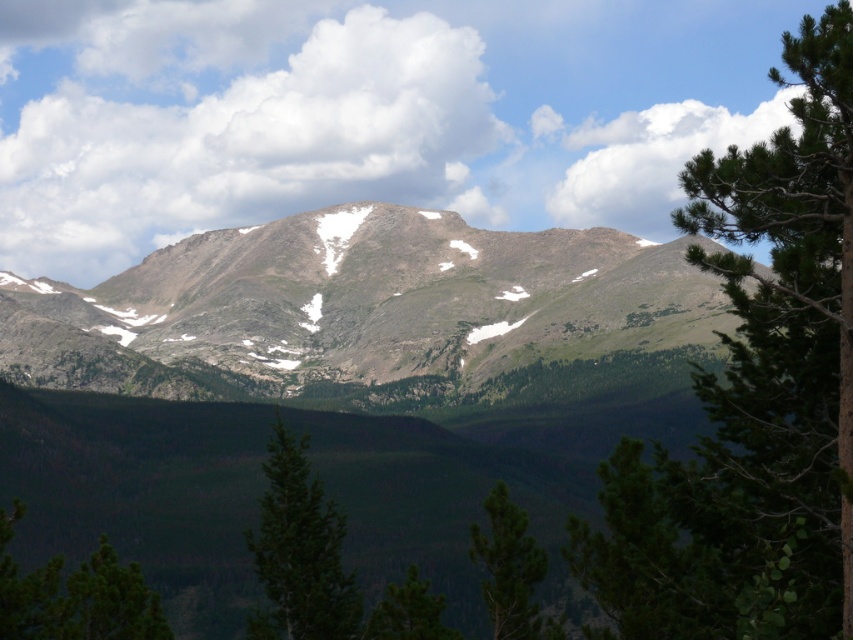
Question: Which point appears farthest from the camera in this image?

Choices:
 (A) (686, 220)
 (B) (405, 602)

Answer: (B)

Question: Is green leafy tree at right further to the viewer compared to green textured tree at center?

Choices:
 (A) yes
 (B) no

Answer: (B)

Question: Is brown rocky mountain at center wider than green matte tree at lower center?

Choices:
 (A) no
 (B) yes

Answer: (B)

Question: Based on their relative distances, which object is nearer to the green leafy tree at right?

Choices:
 (A) green matte tree at center
 (B) green matte tree at lower center
 (C) brown rocky mountain at center

Answer: (B)

Question: Where is green matte tree at center located in relation to green textured tree at center in the image?

Choices:
 (A) right
 (B) left

Answer: (B)

Question: Which of these objects is positioned farthest from the green textured tree at center?

Choices:
 (A) green matte tree at center
 (B) brown rocky mountain at center
 (C) green matte tree at lower center
 (D) green leafy tree at right

Answer: (B)